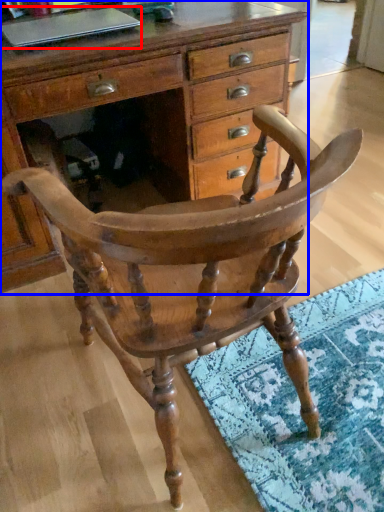
Question: Which point is further to the camera, laptop (highlighted by a red box) or chest of drawers (highlighted by a blue box)?

Choices:
 (A) laptop
 (B) chest of drawers

Answer: (A)